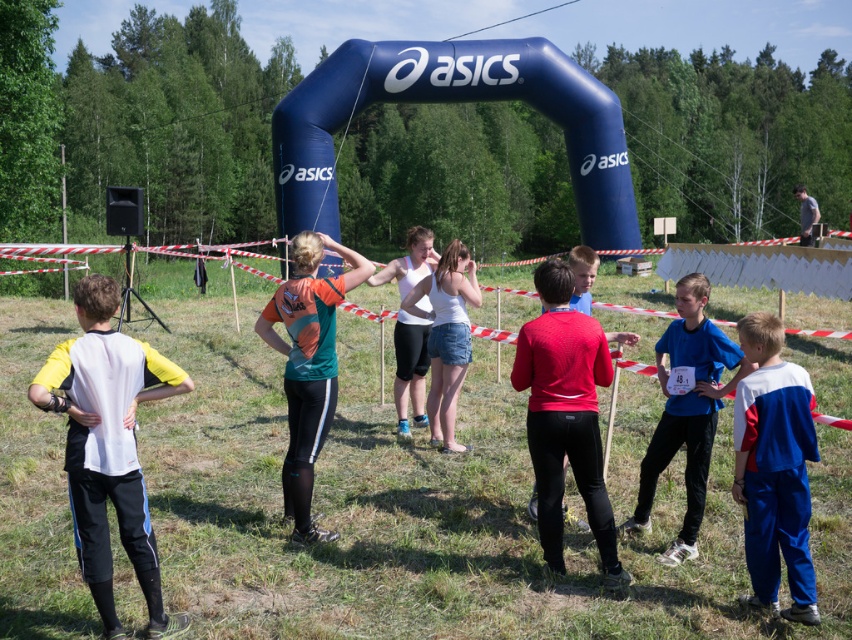
You are a photographer standing at the starting line of the race. You want to take a photo that includes both the point at [539,353] and the point at [283,340]. Which point will appear closer to the camera in the final photo?

The point at [539,353] will appear closer to the camera in the final photo because it is closer to the viewer than the point at [283,340].

You are a photographer at the running event. You need to take a photo of both the matte red sweater at center and the orange fabric shirt at center so that both are fully visible. Which clothing item should you focus on to ensure the other is not cropped out?

The matte red sweater at center is not as tall as the orange fabric shirt at center. To ensure both are fully visible in the photo, focus on the taller orange fabric shirt at center, as it requires more vertical space.